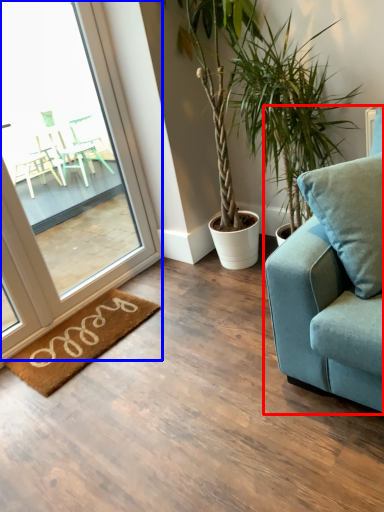
Question: Which of the following is the closest to the observer, studio couch (highlighted by a red box) or window (highlighted by a blue box)?

Choices:
 (A) studio couch
 (B) window

Answer: (A)